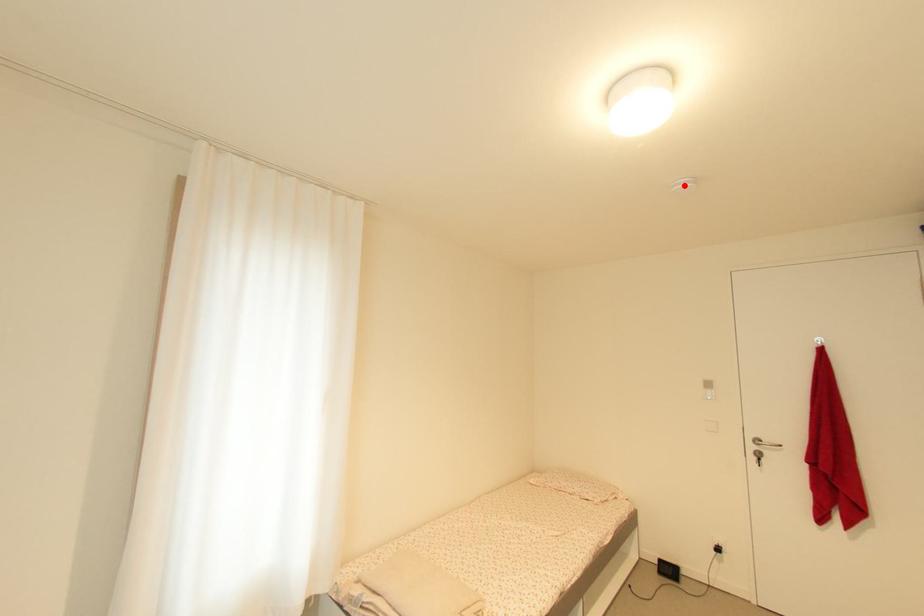
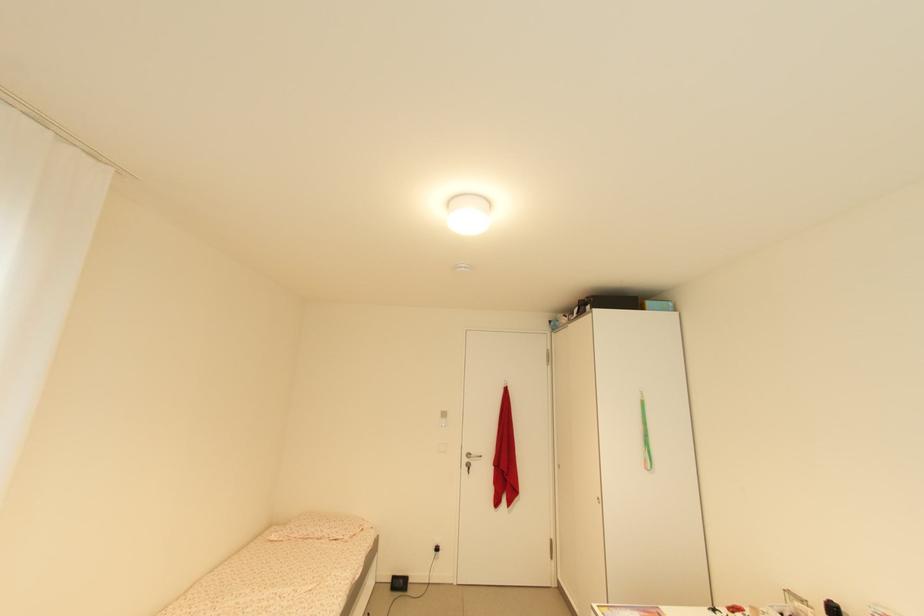
The point at the highlighted location is marked in the first image. Where is the corresponding point in the second image?

(467, 268)